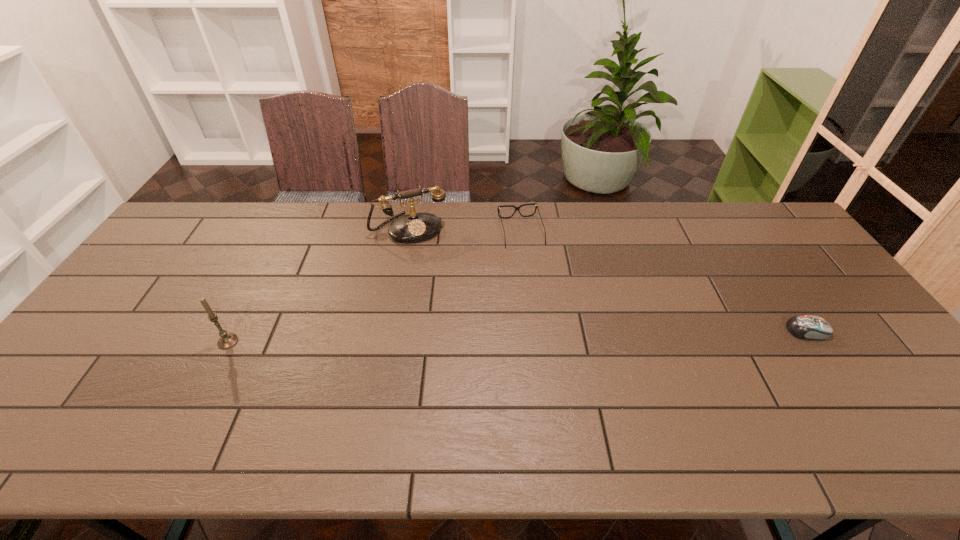
Locate an element on the screen. This screenshot has height=540, width=960. free space on the desktop that is between the leftmost object and the computer mouse and is positioned on the dial of the telephone is located at coordinates (456, 338).

Find the location of a particular element. The width and height of the screenshot is (960, 540). vacant spot on the desktop that is between the leftmost object and the rightmost object and is positioned with the lenses facing outward on the second shortest object is located at coordinates (552, 335).